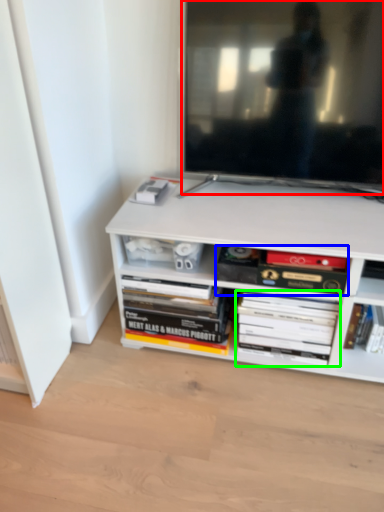
Question: Which object is the farthest from television (highlighted by a red box)? Choose among these: book (highlighted by a blue box) or book (highlighted by a green box).

Choices:
 (A) book
 (B) book

Answer: (B)